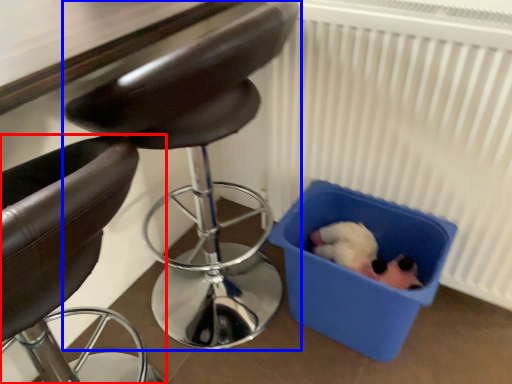
Question: Among these objects, which one is farthest to the camera, chair (highlighted by a red box) or chair (highlighted by a blue box)?

Choices:
 (A) chair
 (B) chair

Answer: (B)